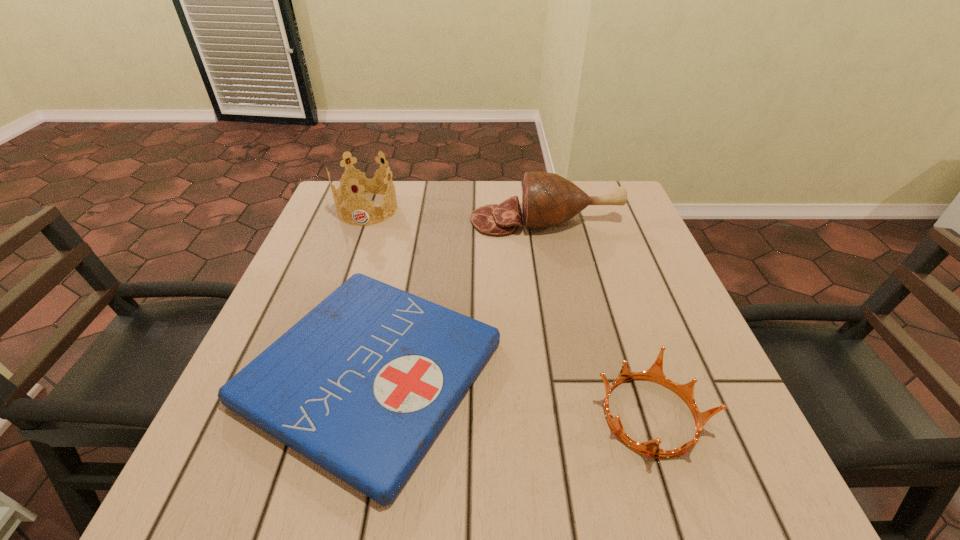
In order to click on free area in between the right crown and the farther crown in this screenshot , I will do `click(509, 313)`.

At what (x,y) coordinates should I click in order to perform the action: click on free spot between the ham and the first-aid kit. Please return your answer as a coordinate pair (x, y). This screenshot has width=960, height=540. Looking at the image, I should click on (458, 296).

The width and height of the screenshot is (960, 540). In order to click on vacant area that lies between the ham and the taller crown in this screenshot , I will do `click(457, 215)`.

Find the location of `free point between the farther crown and the right crown`. free point between the farther crown and the right crown is located at coordinates (509, 313).

Identify the location of vacant point located between the first-aid kit and the nearer crown. This screenshot has width=960, height=540. (511, 394).

Locate an element on the screen. free space that is in between the ham and the nearer crown is located at coordinates (598, 318).

This screenshot has width=960, height=540. In order to click on empty location between the shortest object and the ham in this screenshot , I will do `click(458, 296)`.

At what (x,y) coordinates should I click in order to perform the action: click on free point between the ham and the right crown. Please return your answer as a coordinate pair (x, y). The image size is (960, 540). Looking at the image, I should click on (598, 318).

Select which object appears as the third closest to the shortest object. Please provide its 2D coordinates. Your answer should be formatted as a tuple, i.e. [(x, y)], where the tuple contains the x and y coordinates of a point satisfying the conditions above.

[(361, 180)]

Locate an element on the screen. This screenshot has height=540, width=960. object that is the third closest to the left crown is located at coordinates (651, 448).